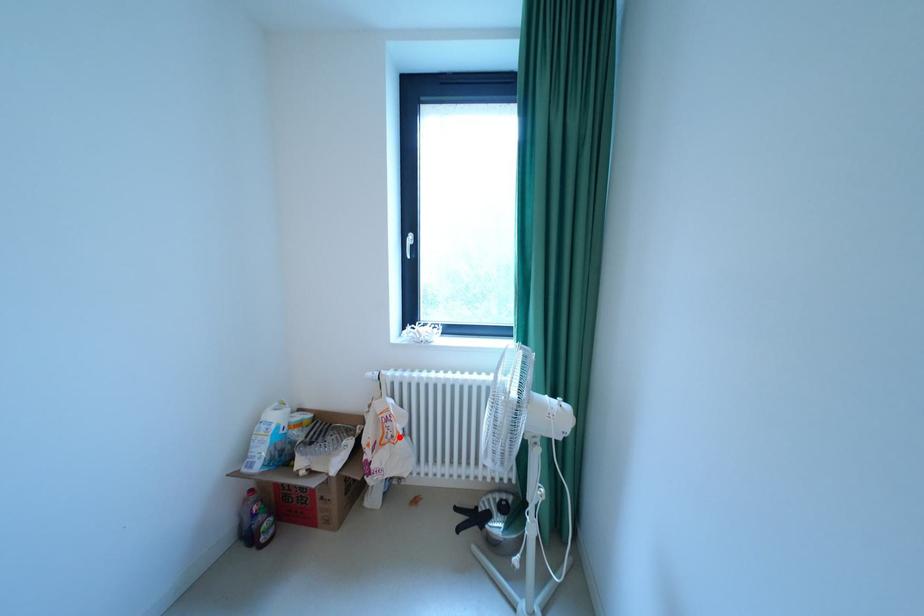
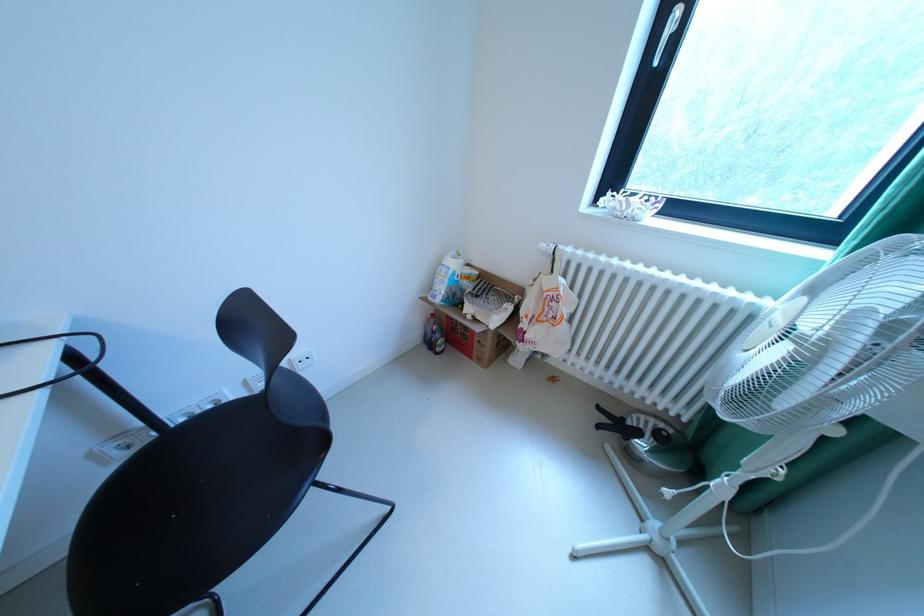
Where in the second image is the point corresponding to the highlighted location from the first image?

(561, 317)